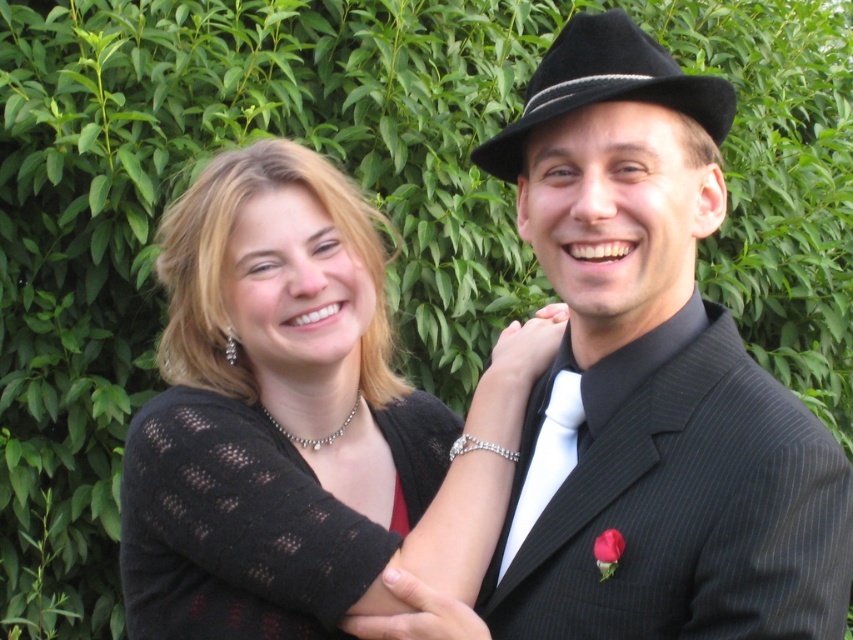
You are standing at the point with coordinates point (679, 602) and want to walk towards the point point (544, 481). Which direction should you move to reach your destination?

To move from point (679, 602) to point (544, 481), you should move backward since point (679, 602) is in front of point (544, 481).

You are a photographer who wants to ensure both the black knitted sweater at center and the black felt fedora at upper right are clearly visible in the photo. Based on their positions, which object is closer to the left side of the frame?

The black knitted sweater at center is positioned on the left side of the black felt fedora at upper right, so the black knitted sweater at center is closer to the left side of the frame.